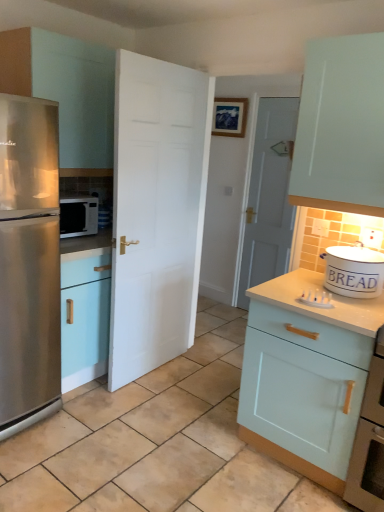
This screenshot has width=384, height=512. What are the coordinates of `free spot to the right of white matte door at center, which ranks as the 2th door in right-to-left order` in the screenshot? It's located at (194, 381).